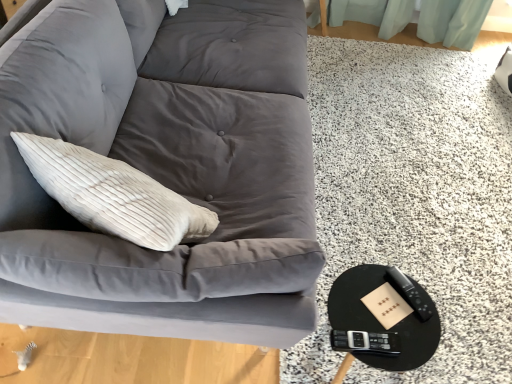
I want to click on unoccupied area in front of black plastic remote at lower right, so click(x=409, y=326).